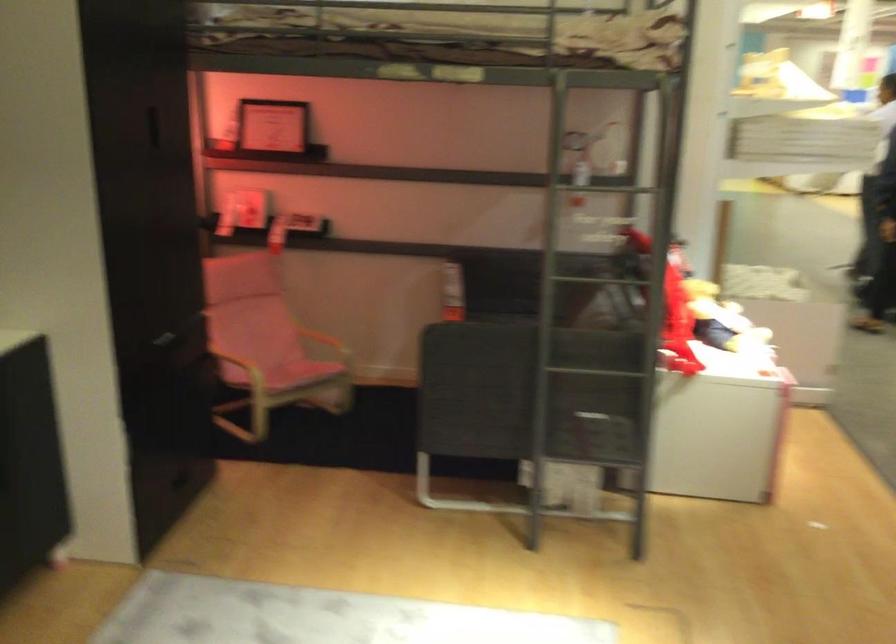
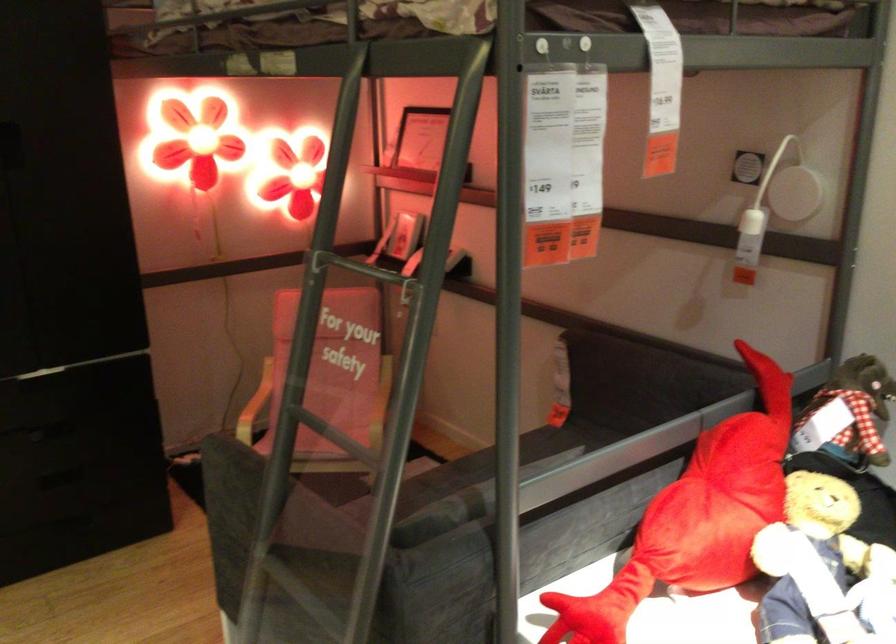
The point at (x=643, y=162) is marked in the first image. Where is the corresponding point in the second image?

(751, 236)